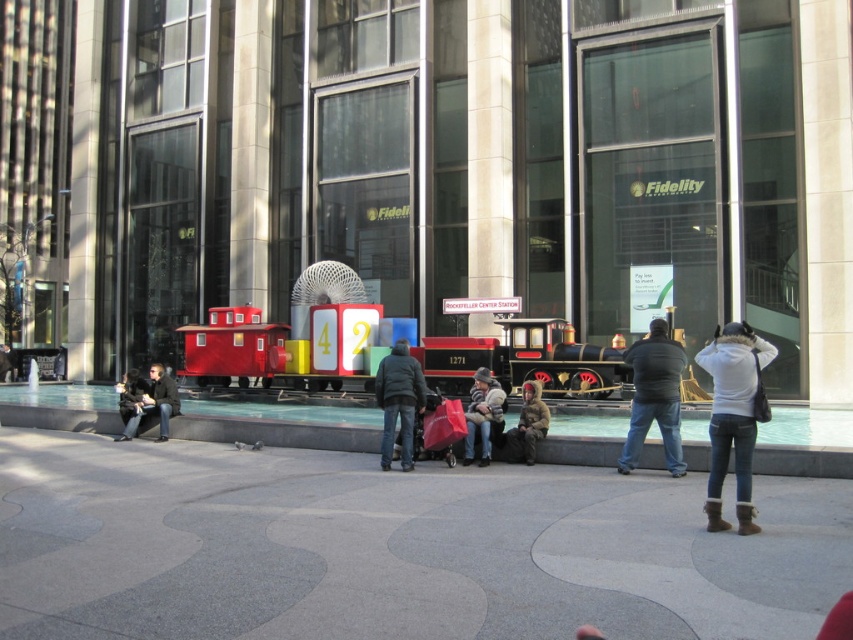
You are a GUI agent. You are given a task and a screenshot of the screen. Output one action in this format:
    pyautogui.click(x=<x>, y=<y>)
    Task: Click on the matte red train at center
    Image resolution: width=853 pixels, height=640 pixels.
    Given the screenshot: What is the action you would take?
    tap(525, 358)

The image size is (853, 640). Describe the element at coordinates (525, 358) in the screenshot. I see `matte red train at center` at that location.

Image resolution: width=853 pixels, height=640 pixels. I want to click on matte red train at center, so click(x=525, y=358).

Is dark gray jacket at left wider than dark gray jacket at lower left?

In fact, dark gray jacket at left might be narrower than dark gray jacket at lower left.

Can you confirm if dark gray jacket at left is smaller than dark gray jacket at lower left?

Indeed, dark gray jacket at left has a smaller size compared to dark gray jacket at lower left.

Is point (166, 394) closer to viewer compared to point (137, 397)?

No.

You are a GUI agent. You are given a task and a screenshot of the screen. Output one action in this format:
    pyautogui.click(x=<x>, y=<y>)
    Task: Click on the dark gray jacket at left
    This screenshot has height=640, width=853.
    Given the screenshot: What is the action you would take?
    pyautogui.click(x=160, y=400)

Which is more to the right, gray woolen sweater at center or dark gray jacket at lower left?

gray woolen sweater at center is more to the right.

What do you see at coordinates (483, 416) in the screenshot? This screenshot has width=853, height=640. I see `gray woolen sweater at center` at bounding box center [483, 416].

Who is more forward, (486, 458) or (123, 419)?

Positioned in front is point (486, 458).

Where is `gray woolen sweater at center`? gray woolen sweater at center is located at coordinates (483, 416).